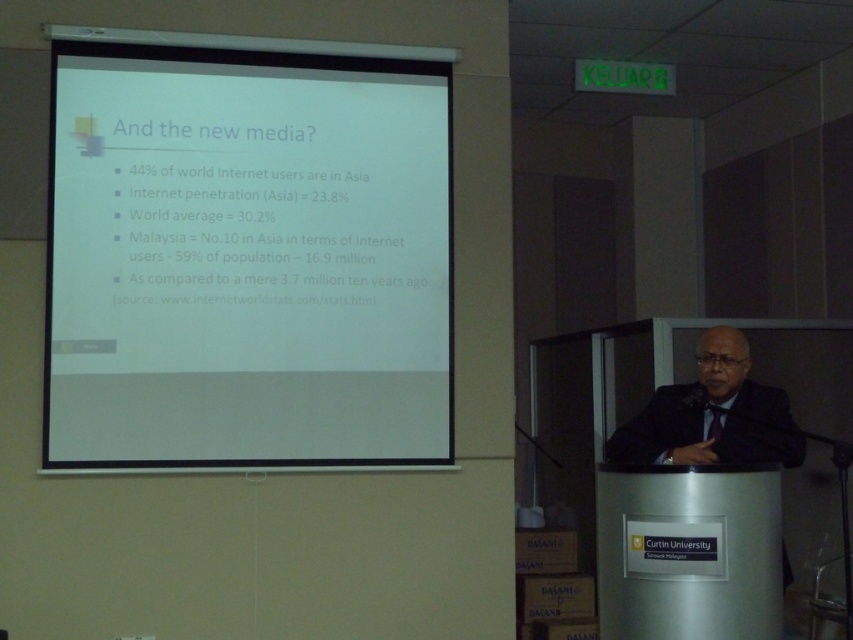
Is white matte projector screen at upper center above black suit at center?

Yes, white matte projector screen at upper center is above black suit at center.

Between white matte projector screen at upper center and black suit at center, which one is positioned higher?

white matte projector screen at upper center is higher up.

The width and height of the screenshot is (853, 640). What do you see at coordinates (247, 253) in the screenshot? I see `white matte projector screen at upper center` at bounding box center [247, 253].

Where is `white matte projector screen at upper center`? This screenshot has height=640, width=853. white matte projector screen at upper center is located at coordinates click(247, 253).